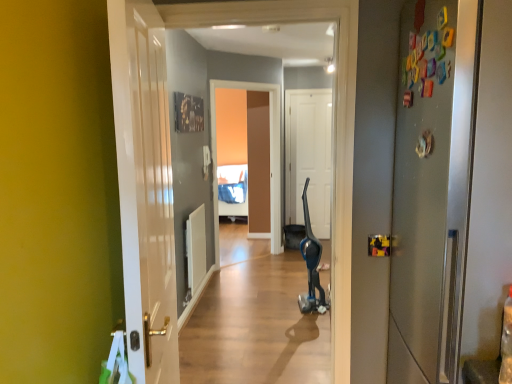
You are a GUI agent. You are given a task and a screenshot of the screen. Output one action in this format:
    pyautogui.click(x=<x>, y=<y>)
    Task: Click on the white glossy door at left, positioned as the 3th door in right-to-left order
    Image resolution: width=512 pixels, height=384 pixels.
    Given the screenshot: What is the action you would take?
    pyautogui.click(x=145, y=188)

The width and height of the screenshot is (512, 384). What do you see at coordinates (145, 188) in the screenshot?
I see `white glossy door at left, the 2th door positioned from the back` at bounding box center [145, 188].

What do you see at coordinates (270, 158) in the screenshot? This screenshot has height=384, width=512. I see `matte brown screen door at center` at bounding box center [270, 158].

At what (x,y) coordinates should I click in order to perform the action: click on white matte door at center, which ranks as the 1th door in back-to-front order. Please return your answer as a coordinate pair (x, y). The width and height of the screenshot is (512, 384). Looking at the image, I should click on (309, 157).

How much distance is there between white matte door at center, the 2th door when ordered from left to right, and matte brown screen door at center?

white matte door at center, the 2th door when ordered from left to right, is 99.32 centimeters from matte brown screen door at center.

Between white matte door at center, positioned as the 3th door in front-to-back order, and matte brown screen door at center, which one has less height?

white matte door at center, positioned as the 3th door in front-to-back order, is shorter.

Is white matte door at center, positioned as the 2th door in right-to-left order, in front of or behind matte brown screen door at center in the image?

white matte door at center, positioned as the 2th door in right-to-left order, is behind matte brown screen door at center.

Is white matte door at center, the 2th door when ordered from left to right, in contact with matte brown screen door at center?

No.

From a real-world perspective, is white glossy door at left, the 2th door positioned from the back, positioned over white matte door at center, positioned as the 2th door in right-to-left order, based on gravity?

Yes, from a real-world perspective, white glossy door at left, the 2th door positioned from the back, is on top of white matte door at center, positioned as the 2th door in right-to-left order.

From their relative heights in the image, would you say white glossy door at left, the first door positioned from the left, is taller or shorter than white matte door at center, positioned as the 2th door in right-to-left order?

Considering their sizes, white glossy door at left, the first door positioned from the left, has less height than white matte door at center, positioned as the 2th door in right-to-left order.

Do you think white glossy door at left, the first door positioned from the left, is within white matte door at center, which ranks as the 1th door in back-to-front order, or outside of it?

white glossy door at left, the first door positioned from the left, exists outside the volume of white matte door at center, which ranks as the 1th door in back-to-front order.

Considering the positions of objects white glossy door at left, the 2th door positioned from the back, and white matte door at center, which ranks as the 1th door in back-to-front order, in the image provided, who is more to the left, white glossy door at left, the 2th door positioned from the back, or white matte door at center, which ranks as the 1th door in back-to-front order,?

Positioned to the left is white glossy door at left, the 2th door positioned from the back.

Is white glossy door at left, positioned as the 3th door in right-to-left order, inside or outside of satin silver refrigerator at right, which ranks as the first door in front-to-back order?

The correct answer is: outside.

Is white glossy door at left, the 2th door positioned from the back, far from satin silver refrigerator at right, positioned as the third door in left-to-right order?

No, white glossy door at left, the 2th door positioned from the back, is in close proximity to satin silver refrigerator at right, positioned as the third door in left-to-right order.

Starting from the white glossy door at left, positioned as the 3th door in right-to-left order, which door is the 2nd one to the right? Please provide its 2D coordinates.

[(432, 187)]

Does white glossy door at left, positioned as the 3th door in right-to-left order, come in front of satin silver refrigerator at right, positioned as the third door in left-to-right order?

No, white glossy door at left, positioned as the 3th door in right-to-left order, is further to the viewer.

Are black plastic vacuum cleaner at center and white glossy door at left, positioned as the 3th door in right-to-left order, making contact?

They are not placed beside each other.

In order to click on door on the left of black plastic vacuum cleaner at center in this screenshot , I will do `click(145, 188)`.

Measure the distance from black plastic vacuum cleaner at center to white glossy door at left, positioned as the 3th door in right-to-left order.

The distance of black plastic vacuum cleaner at center from white glossy door at left, positioned as the 3th door in right-to-left order, is 2.23 meters.

From a real-world perspective, between black plastic vacuum cleaner at center and blue metallic vacuum cleaner at center, who is vertically lower?

blue metallic vacuum cleaner at center.

Locate an element on the screen. Image resolution: width=512 pixels, height=384 pixels. alley that is under the black plastic vacuum cleaner at center (from a real-world perspective) is located at coordinates (254, 320).

Can you confirm if black plastic vacuum cleaner at center is thinner than blue metallic vacuum cleaner at center?

Yes.

Does point (389, 377) come farther from viewer compared to point (245, 323)?

No, (389, 377) is closer to viewer.

Considering the relative sizes of satin silver refrigerator at right, which ranks as the first door in right-to-left order, and blue metallic vacuum cleaner at center in the image provided, is satin silver refrigerator at right, which ranks as the first door in right-to-left order, smaller than blue metallic vacuum cleaner at center?

Indeed, satin silver refrigerator at right, which ranks as the first door in right-to-left order, has a smaller size compared to blue metallic vacuum cleaner at center.

Where is `alley that is under the satin silver refrigerator at right, which is counted as the 3th door, starting from the back (from a real-world perspective)`? The width and height of the screenshot is (512, 384). alley that is under the satin silver refrigerator at right, which is counted as the 3th door, starting from the back (from a real-world perspective) is located at coordinates (254, 320).

Could you tell me if satin silver refrigerator at right, which ranks as the first door in front-to-back order, is turned towards blue metallic vacuum cleaner at center?

No.

Considering the positions of objects matte brown screen door at center and blue metallic vacuum cleaner at center in the image provided, who is in front, matte brown screen door at center or blue metallic vacuum cleaner at center?

Positioned in front is blue metallic vacuum cleaner at center.

Is matte brown screen door at center shorter than blue metallic vacuum cleaner at center?

No.

Who is smaller, matte brown screen door at center or blue metallic vacuum cleaner at center?

Smaller between the two is matte brown screen door at center.

From the image's perspective, is matte brown screen door at center positioned above or below blue metallic vacuum cleaner at center?

Clearly, from the image's perspective, matte brown screen door at center is above blue metallic vacuum cleaner at center.

Identify the location of screen door located underneath the white matte door at center, the 2th door when ordered from left to right (from a real-world perspective). The image size is (512, 384). (270, 158).

What are the coordinates of `the 2nd door positioned above the white glossy door at left, the 2th door positioned from the back (from the image's perspective)` in the screenshot? It's located at (309, 157).

Based on their spatial positions, is white glossy door at left, the 2th door viewed from the front, or satin silver refrigerator at right, which ranks as the first door in right-to-left order, closer to blue metallic vacuum cleaner at center?

Among the two, white glossy door at left, the 2th door viewed from the front, is located nearer to blue metallic vacuum cleaner at center.

Looking at the image, which one is located further to white glossy door at left, the 2th door viewed from the front, blue metallic vacuum cleaner at center or matte brown screen door at center?

The object further to white glossy door at left, the 2th door viewed from the front, is matte brown screen door at center.

Estimate the real-world distances between objects in this image. Which object is closer to blue metallic vacuum cleaner at center, white glossy door at left, the 2th door viewed from the front, or white matte door at center, positioned as the 2th door in right-to-left order?

white matte door at center, positioned as the 2th door in right-to-left order, is closer to blue metallic vacuum cleaner at center.

Based on their spatial positions, is black plastic vacuum cleaner at center or white glossy door at left, the 2th door viewed from the front, closer to satin silver refrigerator at right, which ranks as the first door in right-to-left order?

Among the two, white glossy door at left, the 2th door viewed from the front, is located nearer to satin silver refrigerator at right, which ranks as the first door in right-to-left order.

When comparing their distances from satin silver refrigerator at right, which ranks as the first door in right-to-left order, does white matte door at center, the 2th door when ordered from left to right, or white glossy door at left, positioned as the 3th door in right-to-left order, seem closer?

white glossy door at left, positioned as the 3th door in right-to-left order, is positioned closer to the anchor satin silver refrigerator at right, which ranks as the first door in right-to-left order.

Considering their positions, is white glossy door at left, positioned as the 3th door in right-to-left order, positioned closer to white matte door at center, the 2th door when ordered from left to right, than matte brown screen door at center?

Among the two, matte brown screen door at center is located nearer to white matte door at center, the 2th door when ordered from left to right.

When comparing their distances from matte brown screen door at center, does white matte door at center, the 2th door when ordered from left to right, or white glossy door at left, positioned as the 3th door in right-to-left order, seem further?

white glossy door at left, positioned as the 3th door in right-to-left order.

When comparing their distances from white glossy door at left, positioned as the 3th door in right-to-left order, does white matte door at center, positioned as the 2th door in right-to-left order, or matte brown screen door at center seem closer?

matte brown screen door at center is closer to white glossy door at left, positioned as the 3th door in right-to-left order.

Image resolution: width=512 pixels, height=384 pixels. Identify the location of screen door between black plastic vacuum cleaner at center and white matte door at center, positioned as the 3th door in front-to-back order, in the front-back direction. (270, 158).

Image resolution: width=512 pixels, height=384 pixels. I want to click on door between satin silver refrigerator at right, which is counted as the 3th door, starting from the back, and blue metallic vacuum cleaner at center, along the z-axis, so click(145, 188).

Where is `alley between satin silver refrigerator at right, which ranks as the first door in front-to-back order, and white matte door at center, positioned as the 2th door in right-to-left order, along the z-axis`? The height and width of the screenshot is (384, 512). alley between satin silver refrigerator at right, which ranks as the first door in front-to-back order, and white matte door at center, positioned as the 2th door in right-to-left order, along the z-axis is located at coordinates (254, 320).

Where is `segway between blue metallic vacuum cleaner at center and matte brown screen door at center in the front-back direction`? The height and width of the screenshot is (384, 512). segway between blue metallic vacuum cleaner at center and matte brown screen door at center in the front-back direction is located at coordinates (311, 264).